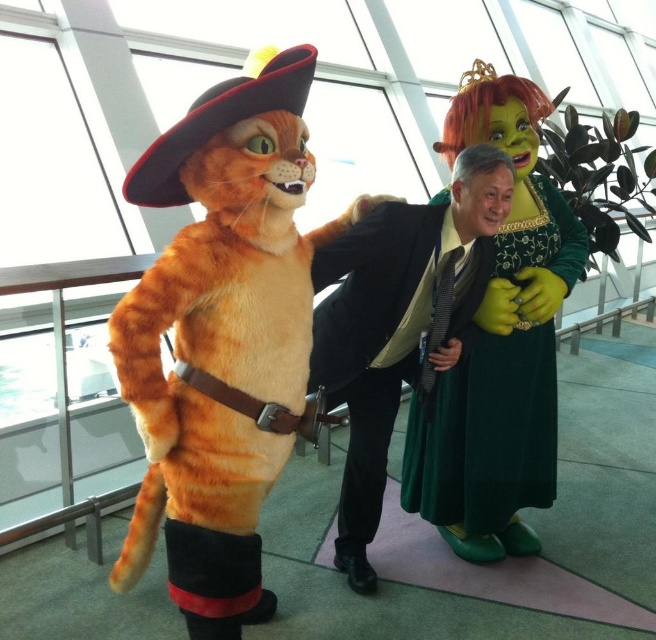
You are standing in the venue and want to take a photo of both the fluffy orange cat at left and the green velvet dress at center. Which direction should you move to ensure both are in frame?

Move to the right so that both the fluffy orange cat at left and the green velvet dress at center are in frame.

You are a photographer planning to take a group photo of the green velvet dress at center and the black suit at center. Which one should you focus on first if you want to highlight the larger object in the frame?

The green velvet dress at center is larger in size than the black suit at center, so you should focus on the green velvet dress at center first to highlight its larger size.